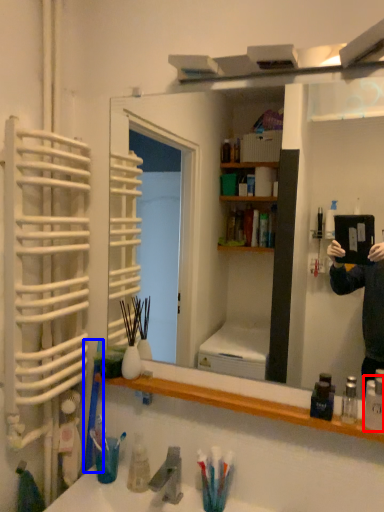
Question: Which point is further to the camera, toiletry (highlighted by a red box) or toothbrush (highlighted by a blue box)?

Choices:
 (A) toiletry
 (B) toothbrush

Answer: (B)